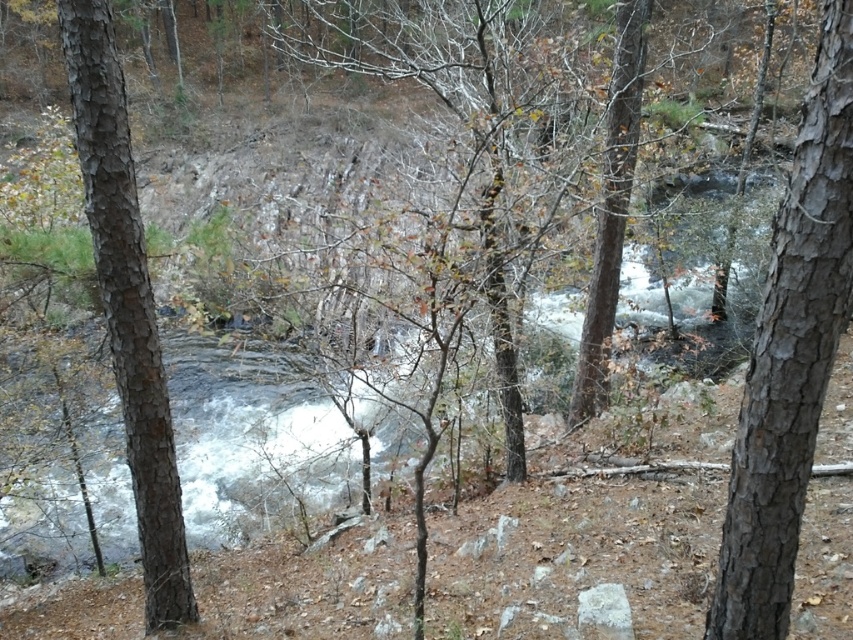
The image size is (853, 640). Describe the element at coordinates (790, 355) in the screenshot. I see `smooth bark tree at right` at that location.

How distant is smooth bark tree at right from smooth bark tree at left?

smooth bark tree at right is 2.72 meters away from smooth bark tree at left.

Which is in front, point (753, 637) or point (115, 355)?

Point (753, 637)

You are a GUI agent. You are given a task and a screenshot of the screen. Output one action in this format:
    pyautogui.click(x=<x>, y=<y>)
    Task: Click on the smooth bark tree at right
    The width and height of the screenshot is (853, 640).
    Given the screenshot: What is the action you would take?
    pyautogui.click(x=790, y=355)

Between smooth bark tree at right and brown rough tree at center, which one is positioned higher?

brown rough tree at center is higher up.

Does smooth bark tree at right come in front of brown rough tree at center?

Yes, smooth bark tree at right is closer to the viewer.

Who is more forward, (782, 316) or (608, 310)?

Point (782, 316) is in front.

Identify the location of smooth bark tree at right. The image size is (853, 640). (790, 355).

Is smooth bark tree at right shorter than brown bark tree at center?

Yes, smooth bark tree at right is shorter than brown bark tree at center.

Is smooth bark tree at right taller than brown bark tree at center?

No.

Based on the photo, who is more distant from viewer, (821, 396) or (364, 38)?

The point (364, 38) is behind.

Identify the location of smooth bark tree at right. (790, 355).